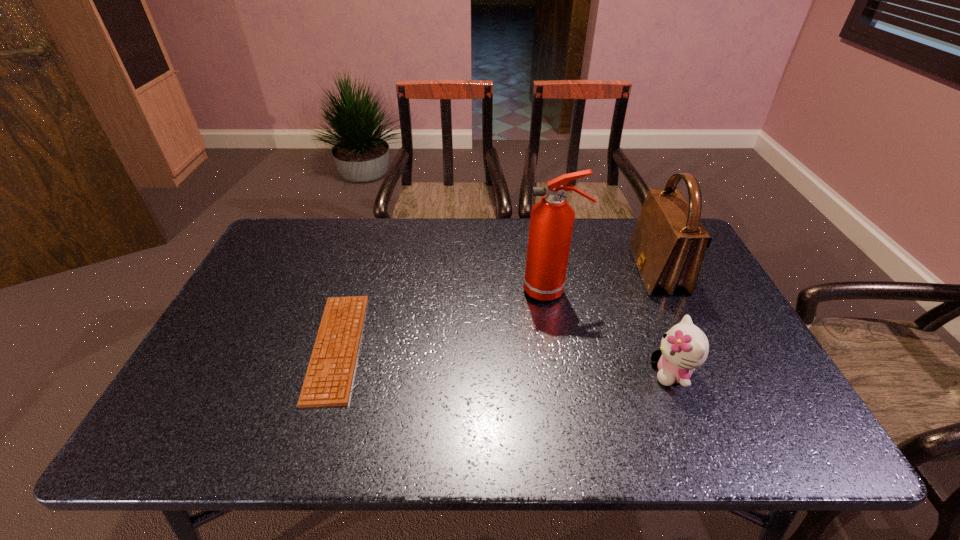
Where is `free space located on the front flap of the third shortest object`? The height and width of the screenshot is (540, 960). free space located on the front flap of the third shortest object is located at coordinates (612, 271).

Where is `free space located 0.150m on the front flap of the third shortest object`? The height and width of the screenshot is (540, 960). free space located 0.150m on the front flap of the third shortest object is located at coordinates (587, 271).

Where is `blank area located on the front-facing side of the third tallest object`? Image resolution: width=960 pixels, height=540 pixels. blank area located on the front-facing side of the third tallest object is located at coordinates (589, 372).

This screenshot has width=960, height=540. Identify the location of vacant space located 0.060m on the front-facing side of the third tallest object. (626, 372).

The height and width of the screenshot is (540, 960). I want to click on free point located on the front-facing side of the third tallest object, so click(531, 372).

I want to click on vacant area located on the back of the computer keyboard, so click(x=372, y=239).

The image size is (960, 540). Find the location of `object that is at the far edge`. object that is at the far edge is located at coordinates (668, 244).

The image size is (960, 540). I want to click on object situated at the right edge, so click(668, 244).

Locate an element on the screen. This screenshot has height=540, width=960. object that is at the far right corner is located at coordinates (668, 244).

Where is `vacant space at the far edge of the desktop`? vacant space at the far edge of the desktop is located at coordinates (x=431, y=232).